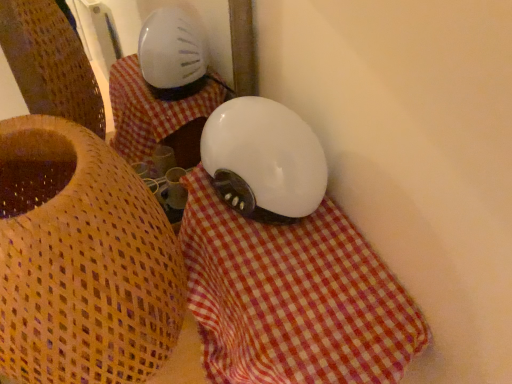
Question: Considering the relative positions of white checkered cloth at center and white glossy helmet at center in the image provided, is white checkered cloth at center to the left of white glossy helmet at center from the viewer's perspective?

Choices:
 (A) no
 (B) yes

Answer: (A)

Question: Does white checkered cloth at center touch white glossy helmet at center?

Choices:
 (A) no
 (B) yes

Answer: (A)

Question: Is white checkered cloth at center to the right of white glossy helmet at center from the viewer's perspective?

Choices:
 (A) yes
 (B) no

Answer: (A)

Question: Considering the relative sizes of white checkered cloth at center and white glossy helmet at center in the image provided, is white checkered cloth at center smaller than white glossy helmet at center?

Choices:
 (A) yes
 (B) no

Answer: (B)

Question: Is white checkered cloth at center further to the viewer compared to white glossy helmet at center?

Choices:
 (A) no
 (B) yes

Answer: (A)

Question: Considering the positions of white glossy helmet at center and matte white lampshade at upper center in the image, is white glossy helmet at center taller or shorter than matte white lampshade at upper center?

Choices:
 (A) tall
 (B) short

Answer: (B)

Question: Relative to matte white lampshade at upper center, is white glossy helmet at center in front or behind?

Choices:
 (A) front
 (B) behind

Answer: (B)

Question: Looking at the image, does white glossy helmet at center seem bigger or smaller compared to matte white lampshade at upper center?

Choices:
 (A) big
 (B) small

Answer: (B)

Question: Does point (273, 124) appear closer or farther from the camera than point (114, 220)?

Choices:
 (A) closer
 (B) farther

Answer: (B)

Question: Based on their positions, is white checkered cloth at center located to the left or right of matte white lampshade at upper center?

Choices:
 (A) right
 (B) left

Answer: (A)

Question: Is white checkered cloth at center inside or outside of matte white lampshade at upper center?

Choices:
 (A) outside
 (B) inside

Answer: (A)

Question: Looking at the image, does white checkered cloth at center seem bigger or smaller compared to matte white lampshade at upper center?

Choices:
 (A) big
 (B) small

Answer: (B)

Question: From their relative heights in the image, would you say white checkered cloth at center is taller or shorter than matte white lampshade at upper center?

Choices:
 (A) short
 (B) tall

Answer: (A)

Question: Considering the positions of matte white lampshade at upper center and white glossy helmet at center in the image, is matte white lampshade at upper center bigger or smaller than white glossy helmet at center?

Choices:
 (A) small
 (B) big

Answer: (B)

Question: Is matte white lampshade at upper center situated inside white glossy helmet at center or outside?

Choices:
 (A) inside
 (B) outside

Answer: (B)